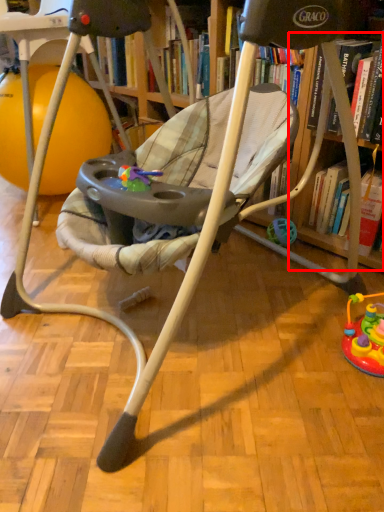
Question: Observing the image, what is the correct spatial positioning of shelf (annotated by the red box) in reference to ball?

Choices:
 (A) left
 (B) right

Answer: (B)